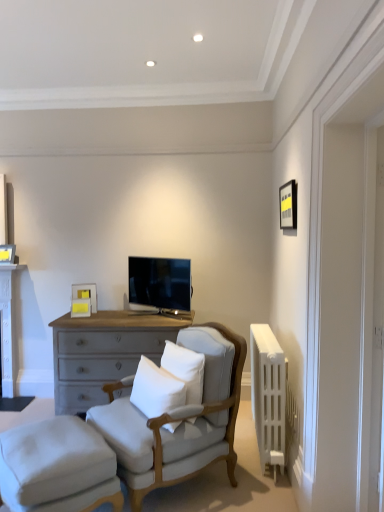
Question: Is light gray fabric chair at center turned away from white soft cushion at center, the 2th pillow in the right-to-left sequence?

Choices:
 (A) no
 (B) yes

Answer: (B)

Question: Does light gray fabric chair at center appear on the left side of white soft cushion at center, which is the first pillow from left to right?

Choices:
 (A) yes
 (B) no

Answer: (B)

Question: Does light gray fabric chair at center contain white soft cushion at center, which is the first pillow from left to right?

Choices:
 (A) yes
 (B) no

Answer: (A)

Question: Can you confirm if light gray fabric chair at center is shorter than white soft cushion at center, which is the first pillow from left to right?

Choices:
 (A) no
 (B) yes

Answer: (A)

Question: Considering the relative sizes of light gray fabric chair at center and white soft cushion at center, which is the first pillow from left to right, in the image provided, is light gray fabric chair at center smaller than white soft cushion at center, which is the first pillow from left to right,?

Choices:
 (A) no
 (B) yes

Answer: (A)

Question: Is light gray fabric chair at center next to white soft cushion at center, the 2th pillow in the right-to-left sequence?

Choices:
 (A) yes
 (B) no

Answer: (B)

Question: From a real-world perspective, is white soft cushion at center, arranged as the second pillow when viewed from the left, located beneath light gray fabric chair at center?

Choices:
 (A) no
 (B) yes

Answer: (A)

Question: Is the depth of white soft cushion at center, marked as the first pillow in a right-to-left arrangement, greater than that of light gray fabric chair at center?

Choices:
 (A) no
 (B) yes

Answer: (B)

Question: From a real-world perspective, is white soft cushion at center, marked as the first pillow in a right-to-left arrangement, located higher than light gray fabric chair at center?

Choices:
 (A) yes
 (B) no

Answer: (A)

Question: Can you confirm if white soft cushion at center, arranged as the second pillow when viewed from the left, is smaller than light gray fabric chair at center?

Choices:
 (A) no
 (B) yes

Answer: (B)

Question: Considering the relative sizes of white soft cushion at center, arranged as the second pillow when viewed from the left, and light gray fabric chair at center in the image provided, is white soft cushion at center, arranged as the second pillow when viewed from the left, bigger than light gray fabric chair at center?

Choices:
 (A) yes
 (B) no

Answer: (B)

Question: Is white soft cushion at center, marked as the first pillow in a right-to-left arrangement, completely or partially outside of light gray fabric chair at center?

Choices:
 (A) yes
 (B) no

Answer: (B)

Question: From the image's perspective, is white painted wood table at left beneath white soft cushion at center, the 2th pillow in the right-to-left sequence?

Choices:
 (A) yes
 (B) no

Answer: (B)